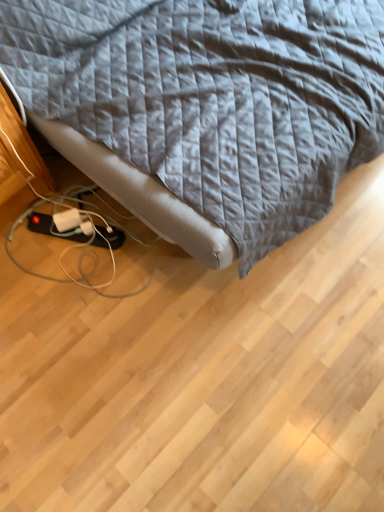
Question: Is white plastic extension cord at lower left at the left side of gray quilted fabric at upper center?

Choices:
 (A) no
 (B) yes

Answer: (B)

Question: Can you confirm if white plastic extension cord at lower left is smaller than gray quilted fabric at upper center?

Choices:
 (A) yes
 (B) no

Answer: (A)

Question: Can you confirm if white plastic extension cord at lower left is wider than gray quilted fabric at upper center?

Choices:
 (A) yes
 (B) no

Answer: (B)

Question: Is white plastic extension cord at lower left thinner than gray quilted fabric at upper center?

Choices:
 (A) no
 (B) yes

Answer: (B)

Question: Can you confirm if white plastic extension cord at lower left is shorter than gray quilted fabric at upper center?

Choices:
 (A) no
 (B) yes

Answer: (B)

Question: Is white plastic extension cord at lower left placed right next to gray quilted fabric at upper center?

Choices:
 (A) yes
 (B) no

Answer: (B)

Question: Is gray quilted fabric at upper center touching white plastic extension cord at lower left?

Choices:
 (A) yes
 (B) no

Answer: (B)

Question: Does gray quilted fabric at upper center come in front of white plastic extension cord at lower left?

Choices:
 (A) yes
 (B) no

Answer: (A)

Question: Does gray quilted fabric at upper center have a greater height compared to white plastic extension cord at lower left?

Choices:
 (A) yes
 (B) no

Answer: (A)

Question: Is gray quilted fabric at upper center far away from white plastic extension cord at lower left?

Choices:
 (A) yes
 (B) no

Answer: (B)

Question: Is gray quilted fabric at upper center bigger than white plastic extension cord at lower left?

Choices:
 (A) yes
 (B) no

Answer: (A)

Question: Does gray quilted fabric at upper center appear on the right side of white plastic extension cord at lower left?

Choices:
 (A) yes
 (B) no

Answer: (A)

Question: From a real-world perspective, is gray quilted fabric at upper center above or below white plastic extension cord at lower left?

Choices:
 (A) below
 (B) above

Answer: (B)